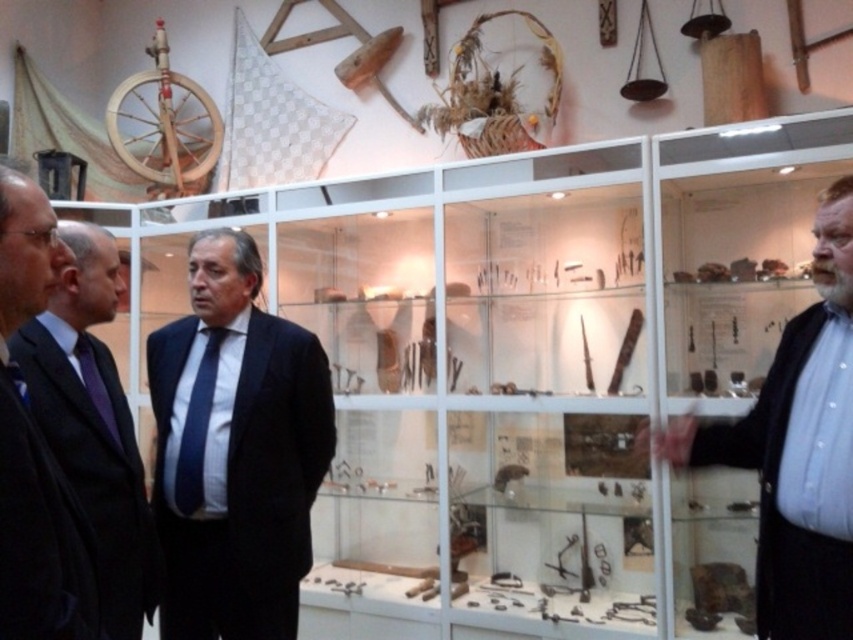
Question: Can you confirm if white shirt at right is positioned above blue striped tie at center?

Choices:
 (A) no
 (B) yes

Answer: (B)

Question: Is dark blue suit at center to the left of blue striped tie at center from the viewer's perspective?

Choices:
 (A) yes
 (B) no

Answer: (B)

Question: Which of the following is the closest to the observer?

Choices:
 (A) (67, 582)
 (B) (312, 444)
 (C) (83, 380)

Answer: (A)

Question: Does black suit at left appear on the right side of black wool suit at left?

Choices:
 (A) no
 (B) yes

Answer: (A)

Question: Among these points, which one is farthest from the camera?

Choices:
 (A) (102, 403)
 (B) (194, 296)
 (C) (137, 624)
 (D) (199, 452)

Answer: (B)

Question: Which object is closer to the camera taking this photo?

Choices:
 (A) black suit at left
 (B) black wool suit at left
 (C) purple satin tie at left
 (D) blue striped tie at center

Answer: (B)